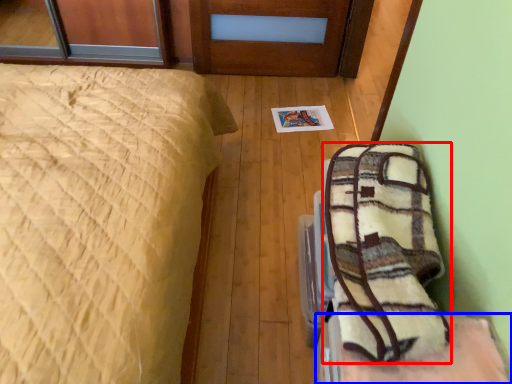
Question: Which point is closer to the camera, blanket (highlighted by a red box) or furniture (highlighted by a blue box)?

Choices:
 (A) blanket
 (B) furniture

Answer: (A)